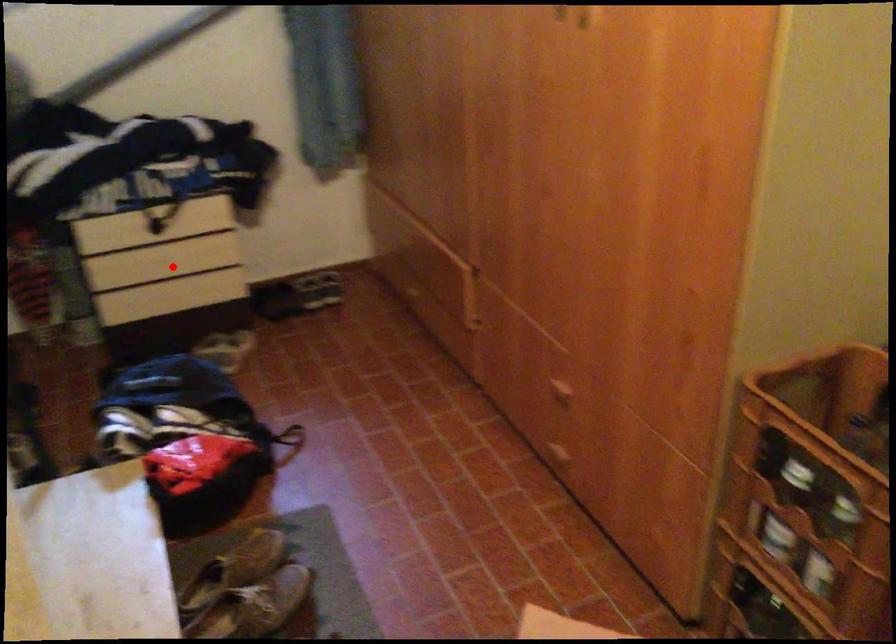
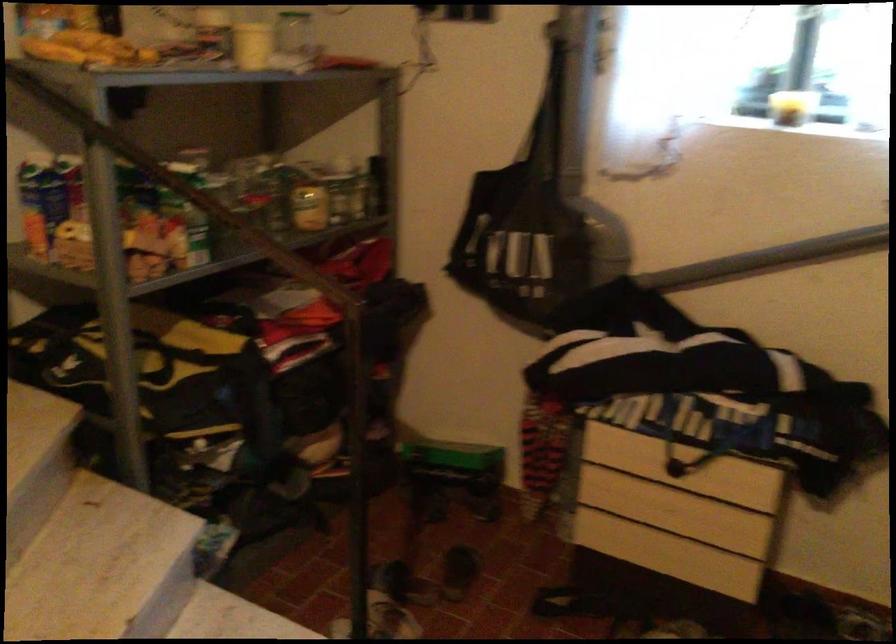
Question: I am providing you with two images of the same scene from different viewpoints. Image1 has a red point marked. In image2, the corresponding 3D location appears at what relative position? Reply with the corresponding letter.

Choices:
 (A) Closer
 (B) Farther

Answer: (A)